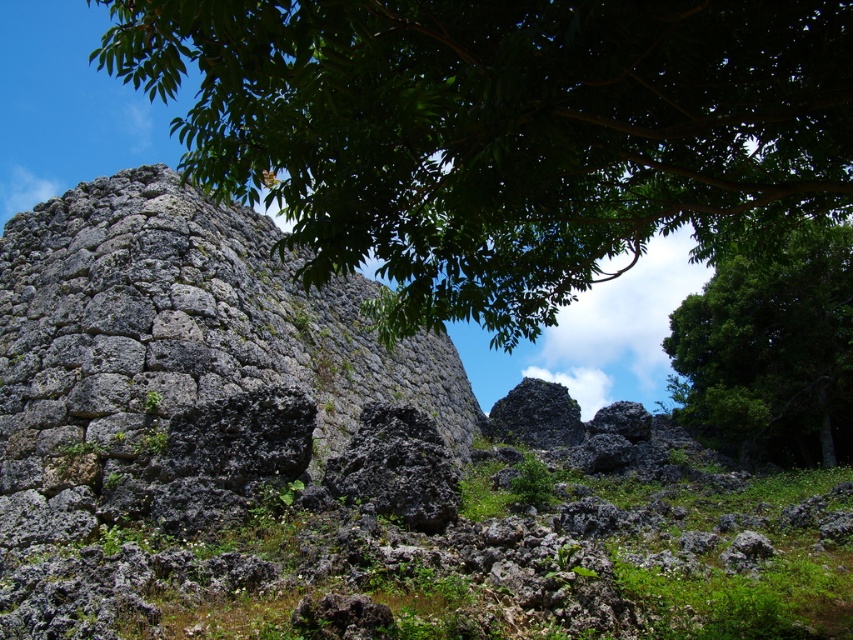
You are an environmental scientist assessing the vegetation in this ancient stone wall landscape. You observe the green leafy tree at upper center and the green leafy tree at upper right. Based on their positions and the scene description, which tree could potentially provide more shade over the stone wall? Explain your reasoning.

The green leafy tree at upper center might provide more shade over the stone wall because it is positioned closer to the center and possibly wider than the green leafy tree at upper right, which is located further to the right. The combination of its central placement and greater width could cast a broader shadow over the wall.